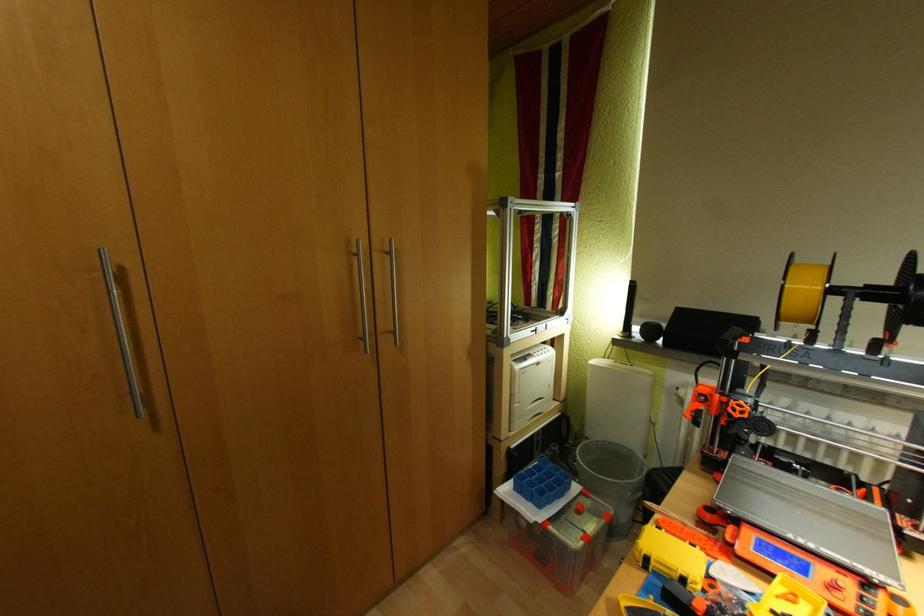
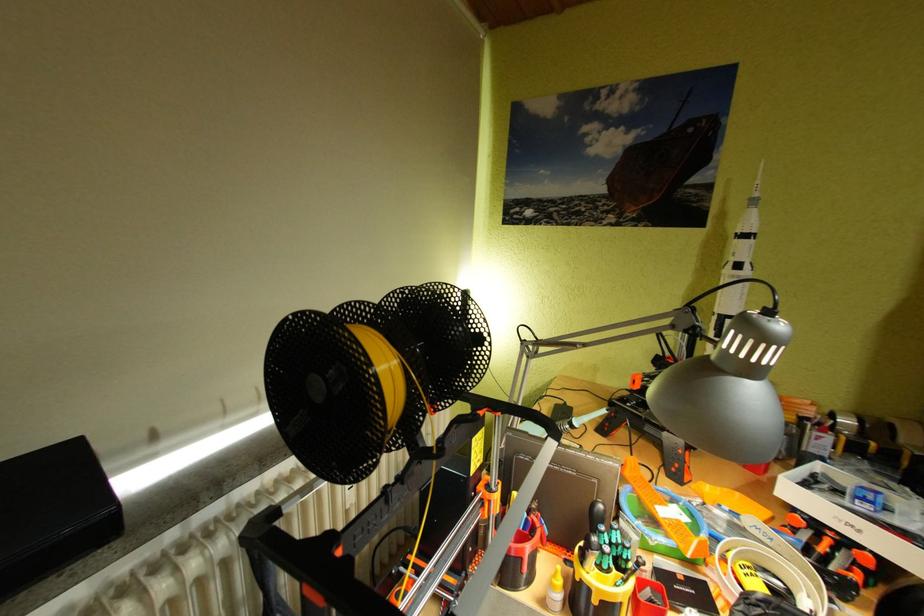
Question: Based on the continuous images, in which direction is the camera rotating? Reply with the corresponding letter.

Choices:
 (A) Left
 (B) Right
 (C) Up
 (D) Down

Answer: (B)